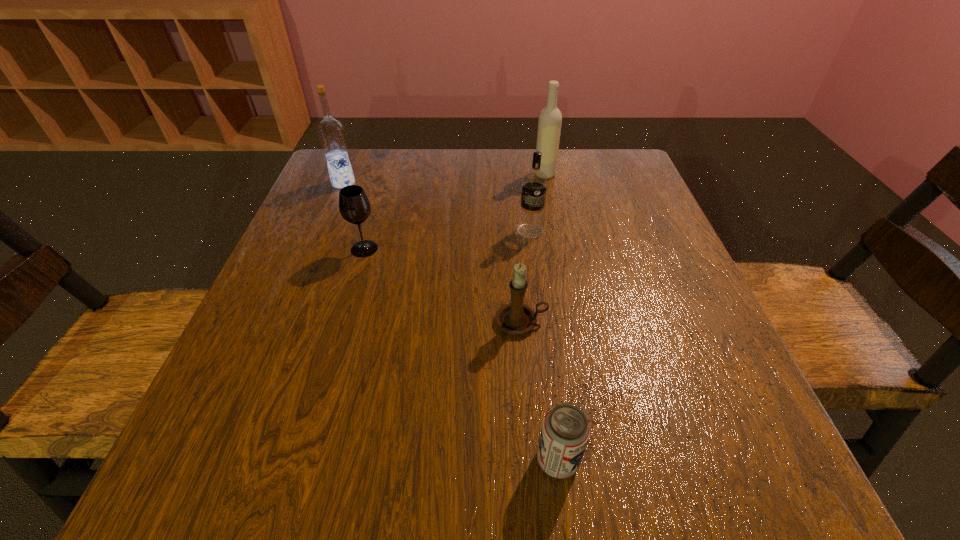
The image size is (960, 540). Find the location of `the leftmost object`. the leftmost object is located at coordinates (331, 133).

Where is `the third farthest object`? the third farthest object is located at coordinates (534, 183).

I want to click on the third tallest object, so click(x=534, y=183).

The image size is (960, 540). Identify the location of the fifth object from right to left. (354, 206).

Where is `the third nearest object`? The width and height of the screenshot is (960, 540). the third nearest object is located at coordinates (354, 206).

Identify the location of the second nearest object. The height and width of the screenshot is (540, 960). (516, 318).

I want to click on the shortest object, so click(565, 431).

Locate an element on the screen. The height and width of the screenshot is (540, 960). beer can is located at coordinates (565, 431).

At what (x,y) coordinates should I click in order to perform the action: click on vacant region located 0.390m on the front of the leftmost object. Please return your answer as a coordinate pair (x, y). Looking at the image, I should click on (290, 313).

At what (x,y) coordinates should I click in order to perform the action: click on free point located on the label of the nearest vodka. Please return your answer as a coordinate pair (x, y). The image size is (960, 540). Looking at the image, I should click on (545, 344).